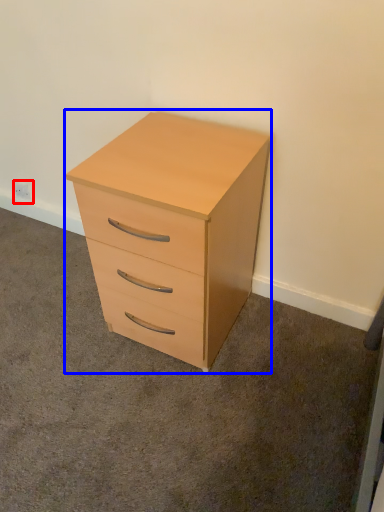
Question: Which point is closer to the camera, electric outlet (highlighted by a red box) or chest of drawers (highlighted by a blue box)?

Choices:
 (A) electric outlet
 (B) chest of drawers

Answer: (B)